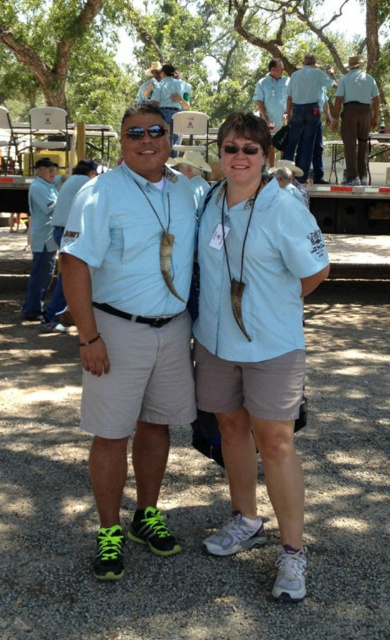
Question: Which point is closer to the camera taking this photo?

Choices:
 (A) [161, 132]
 (B) [292, 160]
 (C) [177, 333]
 (D) [49, 252]

Answer: (A)

Question: From the image, what is the correct spatial relationship of brown corduroy pants at upper right in relation to matte blue shirt at left?

Choices:
 (A) left
 (B) right

Answer: (B)

Question: Which object is farther from the camera taking this photo?

Choices:
 (A) matte blue shirt at left
 (B) light blue fabric shirt at center
 (C) blue shirt at upper center

Answer: (A)

Question: Where is brown corduroy pants at upper right located in relation to matte black sunglasses at center in the image?

Choices:
 (A) right
 (B) left

Answer: (A)

Question: Is matte blue shirt at left bigger than blue denim jeans at upper center?

Choices:
 (A) yes
 (B) no

Answer: (B)

Question: Which object is closer to the camera taking this photo?

Choices:
 (A) brown corduroy pants at upper right
 (B) blue denim jeans at upper center
 (C) light blue fabric shirt at center
 (D) neon green fabric shorts at center

Answer: (C)